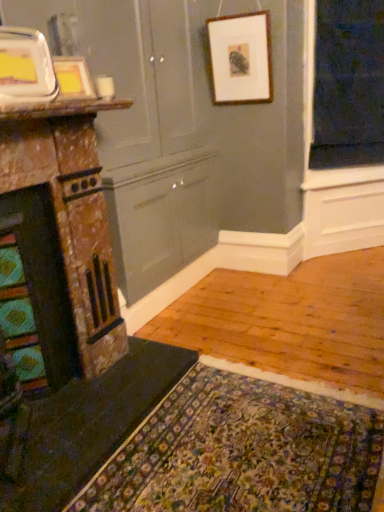
At what (x,y) coordinates should I click in order to perform the action: click on black fabric at upper right. Please return your answer as a coordinate pair (x, y). Looking at the image, I should click on (348, 84).

What do you see at coordinates (241, 58) in the screenshot?
I see `wooden picture frame at upper center, which is counted as the 1th picture frame, starting from the back` at bounding box center [241, 58].

Where is `wooden picture frame at upper center, which ranks as the 1th picture frame in top-to-bottom order`? The height and width of the screenshot is (512, 384). wooden picture frame at upper center, which ranks as the 1th picture frame in top-to-bottom order is located at coordinates (241, 58).

Measure the distance between point (90, 89) and camera.

Point (90, 89) and camera are 5.80 feet apart.

What is the approximate height of marble fireplace at left?

1.19 meters.

Image resolution: width=384 pixels, height=512 pixels. I want to click on black fabric at upper right, so click(348, 84).

From the image's perspective, is wooden picture frame at upper left, which is the second picture frame in left-to-right order, on matte white picture frame at upper left, the third picture frame viewed from the back?

Indeed, from the image's perspective, wooden picture frame at upper left, which is the second picture frame in left-to-right order, is shown above matte white picture frame at upper left, the third picture frame viewed from the back.

Does wooden picture frame at upper left, arranged as the 2th picture frame when ordered from the bottom, have a greater height compared to matte white picture frame at upper left, the third picture frame in the top-to-bottom sequence?

In fact, wooden picture frame at upper left, arranged as the 2th picture frame when ordered from the bottom, may be shorter than matte white picture frame at upper left, the third picture frame in the top-to-bottom sequence.

Which object is wider, wooden picture frame at upper left, arranged as the 2th picture frame when ordered from the bottom, or matte white picture frame at upper left, the 3th picture frame viewed from the right?

With larger width is matte white picture frame at upper left, the 3th picture frame viewed from the right.

Is marble fireplace at left inside matte white picture frame at upper left, which is the first picture frame from left to right?

No, marble fireplace at left is not inside matte white picture frame at upper left, which is the first picture frame from left to right.

Looking at this image, is matte white picture frame at upper left, the 3th picture frame viewed from the right, far from marble fireplace at left?

That's not correct — matte white picture frame at upper left, the 3th picture frame viewed from the right, is a little close to marble fireplace at left.

Is matte white picture frame at upper left, the 3th picture frame viewed from the right, oriented towards marble fireplace at left?

No, matte white picture frame at upper left, the 3th picture frame viewed from the right, is not aimed at marble fireplace at left.

From a real-world perspective, which is physically above, matte white picture frame at upper left, the third picture frame viewed from the back, or marble fireplace at left?

matte white picture frame at upper left, the third picture frame viewed from the back.

Does marble fireplace at left have a greater width compared to white marble countertop at upper left?

Yes.

Is point (19, 115) positioned in front of point (93, 111)?

Yes, point (19, 115) is closer to viewer.

From the image's perspective, which one is positioned lower, marble fireplace at left or white marble countertop at upper left?

marble fireplace at left, from the image's perspective.

Is marble fireplace at left beside dark green felt doormat at lower left?

marble fireplace at left and dark green felt doormat at lower left are clearly separated.

Is marble fireplace at left taller or shorter than dark green felt doormat at lower left?

Clearly, marble fireplace at left is taller compared to dark green felt doormat at lower left.

The height and width of the screenshot is (512, 384). I want to click on fireplace located above the dark green felt doormat at lower left (from the image's perspective), so click(60, 244).

From the picture: Can we say marble fireplace at left lies outside dark green felt doormat at lower left?

Yes, marble fireplace at left is outside of dark green felt doormat at lower left.

Considering the sizes of dark green felt doormat at lower left and marble fireplace at left in the image, is dark green felt doormat at lower left bigger or smaller than marble fireplace at left?

dark green felt doormat at lower left is smaller than marble fireplace at left.

From the image's perspective, does dark green felt doormat at lower left appear lower than marble fireplace at left?

Yes.

Is dark green felt doormat at lower left in contact with marble fireplace at left?

dark green felt doormat at lower left is not next to marble fireplace at left, and they're not touching.

Considering the relative sizes of dark green felt doormat at lower left and marble fireplace at left in the image provided, is dark green felt doormat at lower left taller than marble fireplace at left?

No, dark green felt doormat at lower left is not taller than marble fireplace at left.

Does point (89, 112) appear closer or farther from the camera than point (324, 461)?

Clearly, point (89, 112) is more distant from the camera than point (324, 461).

The image size is (384, 512). I want to click on doormat lying in front of the white marble countertop at upper left, so click(243, 451).

From the picture: Can you confirm if white marble countertop at upper left is taller than dark green felt doormat at lower left?

Indeed, white marble countertop at upper left has a greater height compared to dark green felt doormat at lower left.

Based on the photo, from the image's perspective, is white marble countertop at upper left beneath dark green felt doormat at lower left?

Incorrect, from the image's perspective, white marble countertop at upper left is higher than dark green felt doormat at lower left.

Could you measure the distance between matte white picture frame at upper left, the third picture frame viewed from the back, and wooden picture frame at upper center, which is the 3th picture frame in bottom-to-top order?

matte white picture frame at upper left, the third picture frame viewed from the back, is 1.60 meters from wooden picture frame at upper center, which is the 3th picture frame in bottom-to-top order.

Is point (27, 81) positioned in front of point (234, 29)?

Yes, it is in front of point (234, 29).

Does matte white picture frame at upper left, the third picture frame viewed from the back, have a lesser height compared to wooden picture frame at upper center, which is counted as the 1th picture frame, starting from the back?

Yes, matte white picture frame at upper left, the third picture frame viewed from the back, is shorter than wooden picture frame at upper center, which is counted as the 1th picture frame, starting from the back.

Is the position of matte white picture frame at upper left, which is the 1th picture frame in bottom-to-top order, less distant than that of wooden picture frame at upper center, which is the third picture frame in left-to-right order?

Yes, the depth of matte white picture frame at upper left, which is the 1th picture frame in bottom-to-top order, is less than that of wooden picture frame at upper center, which is the third picture frame in left-to-right order.

Where is `picture frame beneath the matte white picture frame at upper left, the third picture frame in the top-to-bottom sequence (from a real-world perspective)`? picture frame beneath the matte white picture frame at upper left, the third picture frame in the top-to-bottom sequence (from a real-world perspective) is located at coordinates (73, 79).

Where is `picture frame that is the 1st object located behind the marble fireplace at left`? The height and width of the screenshot is (512, 384). picture frame that is the 1st object located behind the marble fireplace at left is located at coordinates (26, 67).

When comparing their distances from wooden picture frame at upper left, the second picture frame viewed from the front, does marble fireplace at left or white marble countertop at upper left seem further?

marble fireplace at left is further to wooden picture frame at upper left, the second picture frame viewed from the front.

In the scene shown: Based on their spatial positions, is black fabric at upper right or marble fireplace at left closer to matte white picture frame at upper left, the third picture frame in the top-to-bottom sequence?

marble fireplace at left.

Which object lies nearer to the anchor point dark green felt doormat at lower left, wooden picture frame at upper center, which is counted as the 1th picture frame, starting from the back, or matte white picture frame at upper left, which is the first picture frame from left to right?

matte white picture frame at upper left, which is the first picture frame from left to right, lies closer to dark green felt doormat at lower left than the other object.

Estimate the real-world distances between objects in this image. Which object is further from marble fireplace at left, wooden picture frame at upper left, arranged as the second picture frame when viewed from the top, or white marble countertop at upper left?

wooden picture frame at upper left, arranged as the second picture frame when viewed from the top, is further to marble fireplace at left.

Looking at the image, which one is located further to black fabric at upper right, matte white picture frame at upper left, the third picture frame in the top-to-bottom sequence, or white marble countertop at upper left?

matte white picture frame at upper left, the third picture frame in the top-to-bottom sequence.

When comparing their distances from wooden picture frame at upper left, which ranks as the second picture frame in back-to-front order, does wooden picture frame at upper center, which is the third picture frame in left-to-right order, or black fabric at upper right seem closer?

wooden picture frame at upper center, which is the third picture frame in left-to-right order, lies closer to wooden picture frame at upper left, which ranks as the second picture frame in back-to-front order, than the other object.

Which object lies nearer to the anchor point black fabric at upper right, wooden picture frame at upper center, which is the 3th picture frame in bottom-to-top order, or white marble countertop at upper left?

wooden picture frame at upper center, which is the 3th picture frame in bottom-to-top order, lies closer to black fabric at upper right than the other object.

From the image, which object appears to be farther from matte white picture frame at upper left, the third picture frame viewed from the back, white marble countertop at upper left or wooden picture frame at upper left, which is the second picture frame in left-to-right order?

The object further to matte white picture frame at upper left, the third picture frame viewed from the back, is wooden picture frame at upper left, which is the second picture frame in left-to-right order.

At what (x,y) coordinates should I click in order to perform the action: click on fireplace between wooden picture frame at upper left, the second picture frame viewed from the front, and dark green felt doormat at lower left in the up-down direction. Please return your answer as a coordinate pair (x, y). This screenshot has width=384, height=512. Looking at the image, I should click on (60, 244).

Locate an element on the screen. This screenshot has width=384, height=512. picture frame between white marble countertop at upper left and wooden picture frame at upper center, arranged as the 1th picture frame when viewed from the right, in the front-back direction is located at coordinates coord(73,79).

You are a GUI agent. You are given a task and a screenshot of the screen. Output one action in this format:
    pyautogui.click(x=<x>, y=<y>)
    Task: Click on the counter top between wooden picture frame at upper center, which ranks as the 1th picture frame in top-to-bottom order, and dark green felt doormat at lower left in the up-down direction
    
    Given the screenshot: What is the action you would take?
    pyautogui.click(x=62, y=108)

The width and height of the screenshot is (384, 512). What are the coordinates of `fireplace between wooden picture frame at upper center, which ranks as the 1th picture frame in top-to-bottom order, and dark green felt doormat at lower left, in the vertical direction` in the screenshot? It's located at pyautogui.click(x=60, y=244).